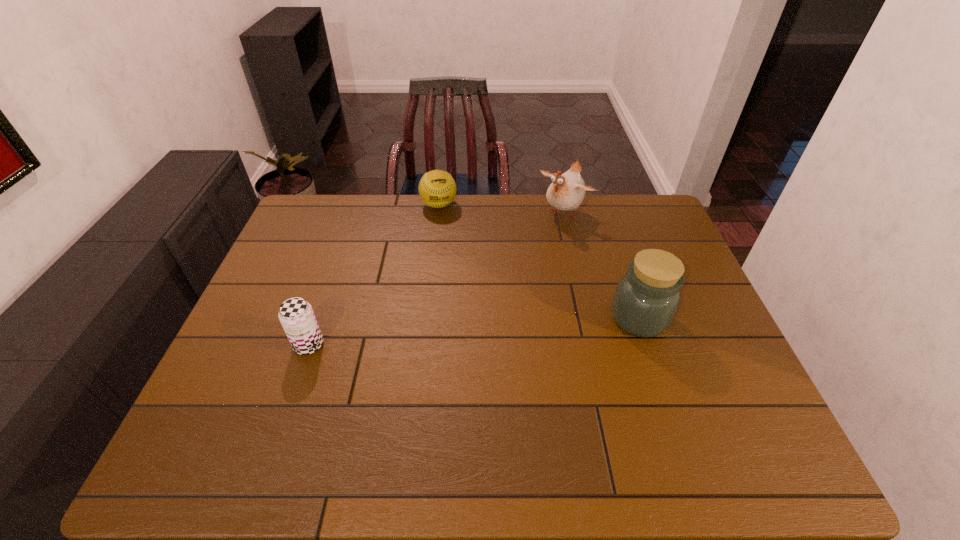
Locate an element on the screen. The width and height of the screenshot is (960, 540). free space on the desktop that is between the beer can and the jar and is positioned at the beak of the bird is located at coordinates (442, 334).

Find the location of `vacant space on the desktop that is between the beer can and the jar and is positioned on the logo side of the third object from right to left`. vacant space on the desktop that is between the beer can and the jar and is positioned on the logo side of the third object from right to left is located at coordinates (471, 332).